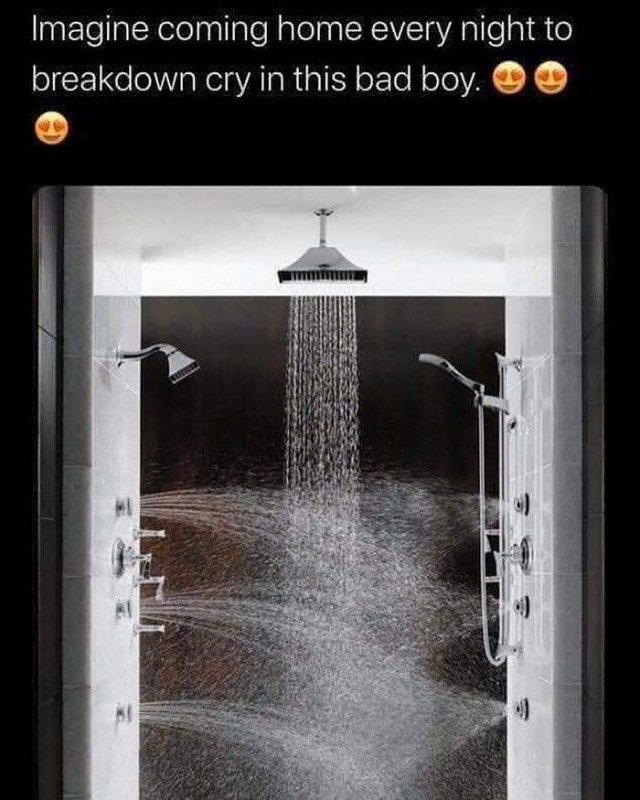
Where is `left shower head`? The height and width of the screenshot is (800, 640). left shower head is located at coordinates (180, 369).